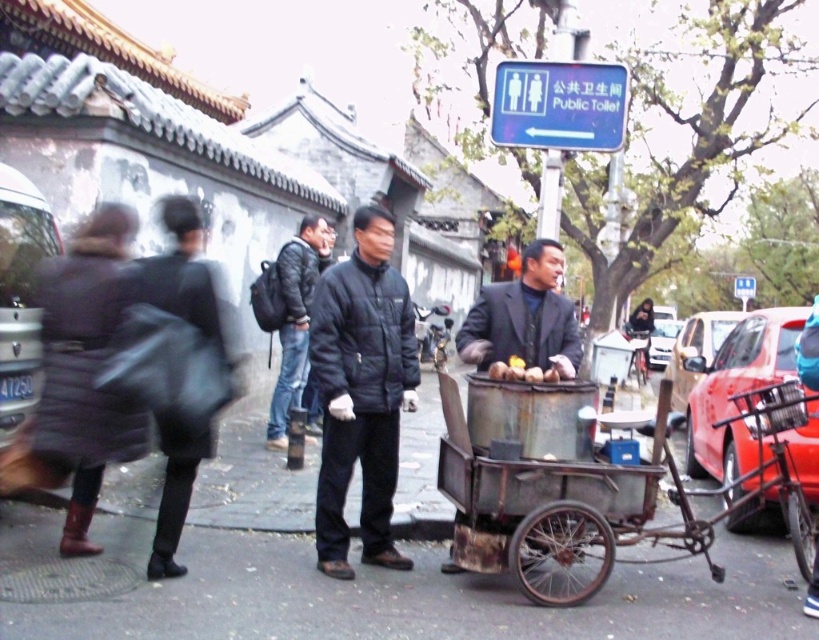
You are standing at the camera position and want to cross the street to the food cart. The road is 5 meters wide. Is there enough space to safely cross without moving the metallic red car at right?

The distance between the camera and the metallic red car at right is 4.85 meters. Since the road is 5 meters wide, there is enough space to safely cross without moving the metallic red car at right.